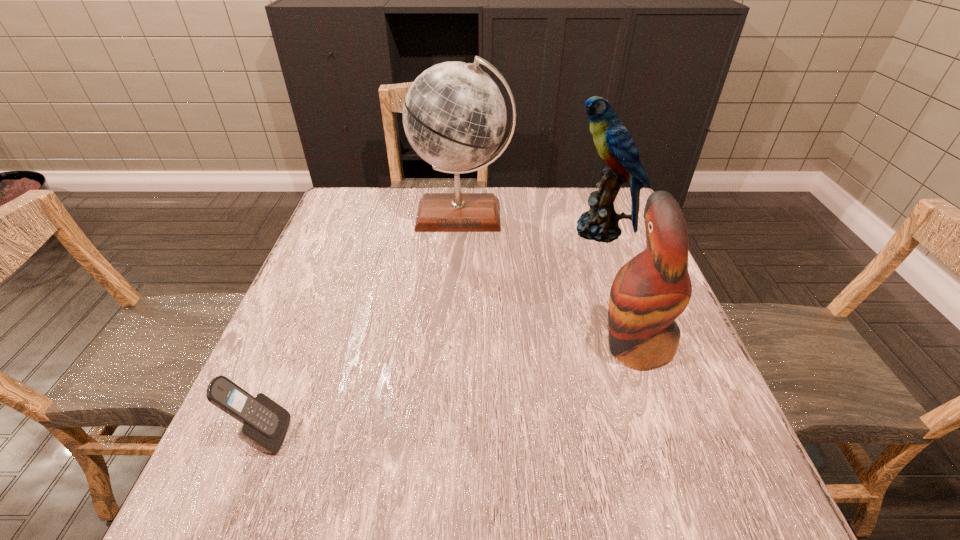
Where is `free space between the shortest object and the third object from right to left`? free space between the shortest object and the third object from right to left is located at coordinates (363, 325).

Select which object appears as the closest to the third farthest object. Please provide its 2D coordinates. Your answer should be formatted as a tuple, i.e. [(x, y)], where the tuple contains the x and y coordinates of a point satisfying the conditions above.

[(614, 144)]

You are a GUI agent. You are given a task and a screenshot of the screen. Output one action in this format:
    pyautogui.click(x=<x>, y=<y>)
    Task: Click on the closest object relative to the shortest object
    The width and height of the screenshot is (960, 540).
    Given the screenshot: What is the action you would take?
    pyautogui.click(x=454, y=115)

Locate an element on the screen. Image resolution: width=960 pixels, height=540 pixels. vacant space that satisfies the following two spatial constraints: 1. at the equator of the tallest object; 2. on the front-facing side of the shortest object is located at coordinates (450, 435).